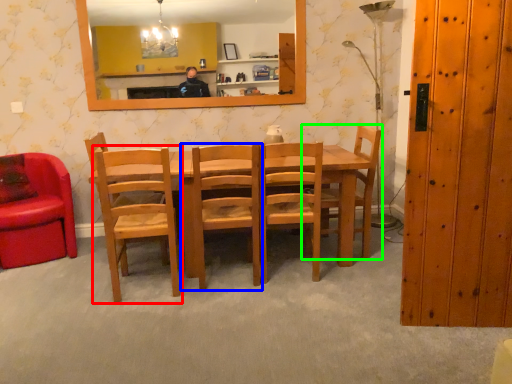
Question: Considering the real-world distances, which object is farthest from chair (highlighted by a red box)? chair (highlighted by a blue box) or chair (highlighted by a green box)?

Choices:
 (A) chair
 (B) chair

Answer: (B)